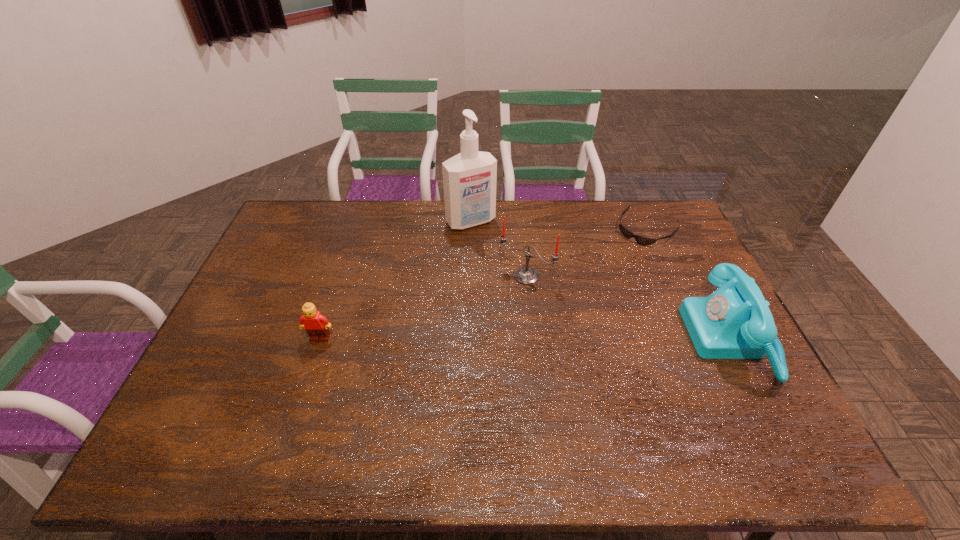
Locate an element on the screen. The image size is (960, 540). free region located on the dial of the telephone is located at coordinates (597, 339).

I want to click on vacant region located on the dial of the telephone, so click(659, 339).

You are a GUI agent. You are given a task and a screenshot of the screen. Output one action in this format:
    pyautogui.click(x=<x>, y=<y>)
    Task: Click on the free space located on the front-facing side of the candle
    
    Given the screenshot: What is the action you would take?
    pyautogui.click(x=481, y=335)

Image resolution: width=960 pixels, height=540 pixels. I want to click on vacant space situated 0.310m on the front-facing side of the candle, so click(x=465, y=359).

Find the location of a particular element. free location located on the front-facing side of the candle is located at coordinates (447, 384).

I want to click on vacant space located on the front label of the cleansing agent, so click(499, 257).

The height and width of the screenshot is (540, 960). I want to click on vacant area situated 0.380m on the front label of the cleansing agent, so click(534, 303).

Locate an element on the screen. This screenshot has width=960, height=540. vacant space located 0.340m on the front label of the cleansing agent is located at coordinates (527, 294).

Where is `vacant space located on the front-facing side of the shortest object`? The height and width of the screenshot is (540, 960). vacant space located on the front-facing side of the shortest object is located at coordinates (610, 264).

The image size is (960, 540). I want to click on vacant area situated on the front-facing side of the shortest object, so click(x=578, y=295).